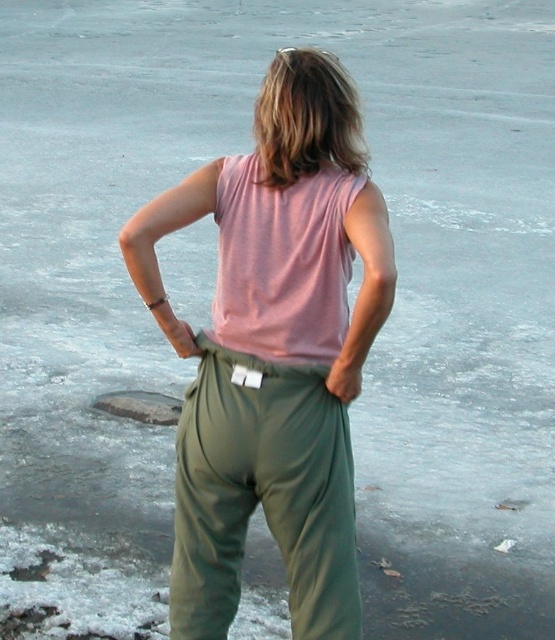
You are a fashion designer observing a model wearing the matte pink tank top at center and olive green fabric pants at center. Which piece of clothing is positioned more to the left on the model?

The matte pink tank top at center is positioned more to the left than the olive green fabric pants at center.

You are a photographer trying to capture the person in the scene. Since the matte pink tank top at center and the olive green fabric pants at center are both at the center, which one will be more visible in your photo?

The matte pink tank top at center is in front of the olive green fabric pants at center, so it will be more visible in the photo.

You are a fashion designer observing the person in the image. You need to determine if the matte pink tank top at center is visible beneath the olive green fabric pants at center. Based on the scene description, can you confirm this?

The matte pink tank top at center is positioned over the olive green fabric pants at center, meaning the tank top is covering the pants and thus not visible beneath them.